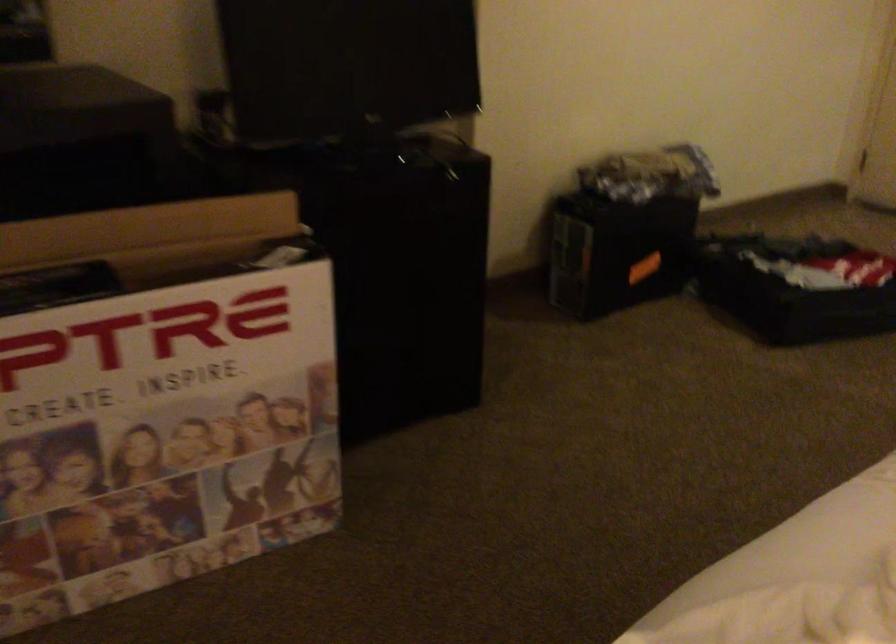
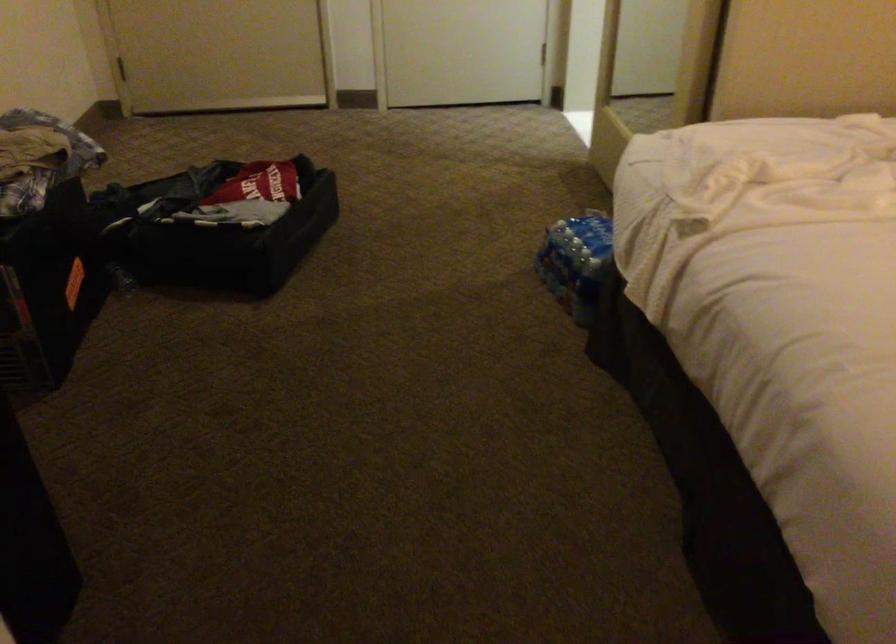
The images are taken continuously from a first-person perspective. In which direction is your viewpoint rotating?

The rotation direction of the camera is right-down.